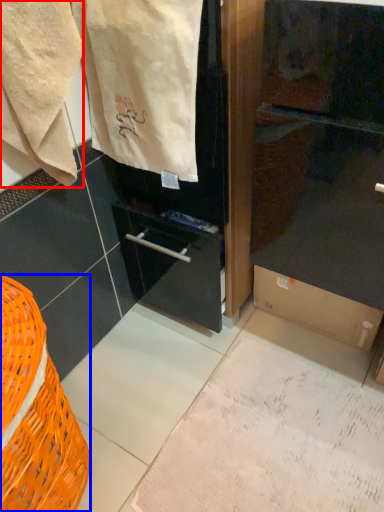
Question: Which point is further to the camera, towel (highlighted by a red box) or basket (highlighted by a blue box)?

Choices:
 (A) towel
 (B) basket

Answer: (A)